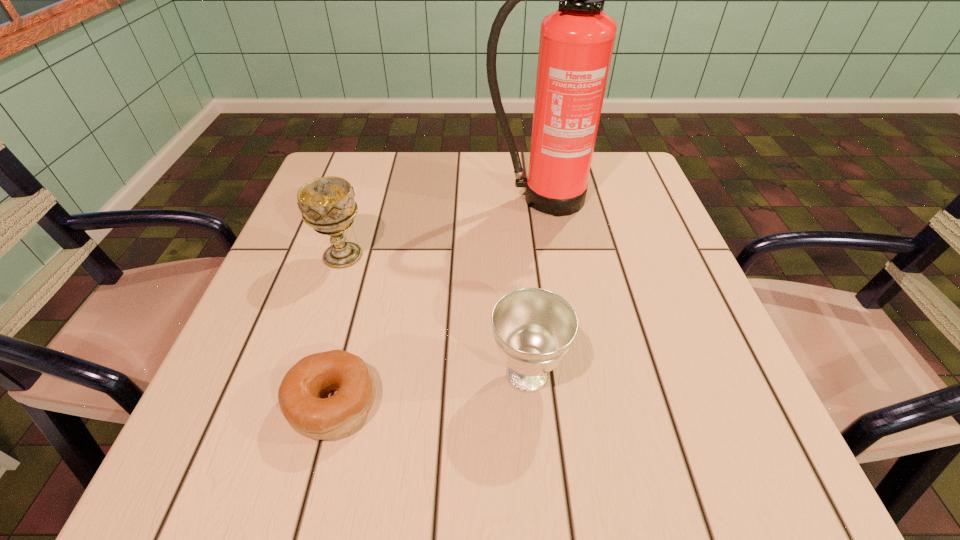
Locate an element on the screen. The width and height of the screenshot is (960, 540). empty space that is in between the bagel and the nearer chalice is located at coordinates (430, 388).

At what (x,y) coordinates should I click in order to perform the action: click on free space that is in between the left chalice and the bagel. Please return your answer as a coordinate pair (x, y). The height and width of the screenshot is (540, 960). Looking at the image, I should click on (338, 329).

Image resolution: width=960 pixels, height=540 pixels. Identify the location of free spot between the farthest object and the right chalice. (534, 287).

Identify the location of empty space that is in between the tallest object and the shortest object. The width and height of the screenshot is (960, 540). click(437, 300).

Identify the location of object that is the second closest one to the right chalice. (327, 204).

Select which object is the closest to the right chalice. Please provide its 2D coordinates. Your answer should be formatted as a tuple, i.e. [(x, y)], where the tuple contains the x and y coordinates of a point satisfying the conditions above.

[(300, 394)]

Image resolution: width=960 pixels, height=540 pixels. In order to click on free location that satisfies the following two spatial constraints: 1. on the back side of the shortest object; 2. on the right side of the nearer chalice in this screenshot , I will do `click(341, 374)`.